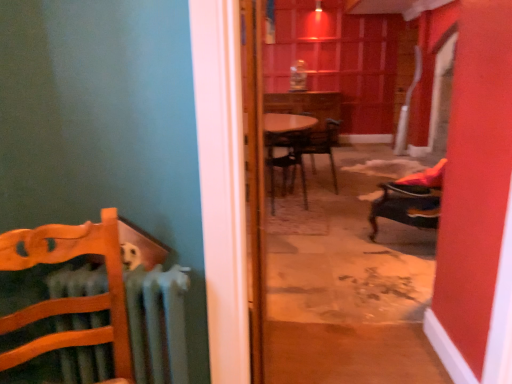
Describe the element at coordinates (410, 200) in the screenshot. I see `velvet orange chair at right, which ranks as the first chair in right-to-left order` at that location.

Where is `wooden chair at left, the first chair viewed from the front`? The height and width of the screenshot is (384, 512). wooden chair at left, the first chair viewed from the front is located at coordinates (70, 297).

The image size is (512, 384). In order to click on velvet orange chair at right, which is counted as the fourth chair, starting from the left in this screenshot , I will do click(410, 200).

Considering the relative sizes of wooden door at center and velvet orange chair at right, which is counted as the fourth chair, starting from the left, in the image provided, is wooden door at center taller than velvet orange chair at right, which is counted as the fourth chair, starting from the left,?

Yes.

Is wooden door at center not near velvet orange chair at right, which ranks as the first chair in right-to-left order?

Absolutely, wooden door at center is distant from velvet orange chair at right, which ranks as the first chair in right-to-left order.

Consider the image. Is wooden door at center oriented away from velvet orange chair at right, which ranks as the first chair in right-to-left order?

No, wooden door at center is not facing the opposite direction of velvet orange chair at right, which ranks as the first chair in right-to-left order.

Considering the positions of point (251, 249) and point (371, 209), is point (251, 249) closer or farther from the camera than point (371, 209)?

Clearly, point (251, 249) is closer to the camera than point (371, 209).

Looking at the image, does velvet orange chair at right, which is counted as the second chair, starting from the front, seem bigger or smaller compared to wooden chair at left, placed as the 4th chair when sorted from back to front?

Considering their sizes, velvet orange chair at right, which is counted as the second chair, starting from the front, takes up more space than wooden chair at left, placed as the 4th chair when sorted from back to front.

Could you tell me if velvet orange chair at right, which is counted as the second chair, starting from the front, is turned towards wooden chair at left, the 4th chair when ordered from right to left?

No, velvet orange chair at right, which is counted as the second chair, starting from the front, is not aimed at wooden chair at left, the 4th chair when ordered from right to left.

This screenshot has width=512, height=384. In order to click on the 1st chair behind the wooden chair at left, the first chair viewed from the front, counting from the anchor's position in this screenshot , I will do `click(410, 200)`.

Does metallic dark brown chair at center, marked as the third chair in a left-to-right arrangement, have a greater height compared to wooden door at center?

No.

Which is further, (x=325, y=136) or (x=247, y=113)?

The point (x=325, y=136) is behind.

From the picture: From the image's perspective, is metallic dark brown chair at center, the 4th chair positioned from the front, located above wooden door at center?

Yes, from the image's perspective, metallic dark brown chair at center, the 4th chair positioned from the front, is on top of wooden door at center.

Is metallic dark brown chair at center, the 4th chair positioned from the front, placed right next to wooden door at center?

metallic dark brown chair at center, the 4th chair positioned from the front, and wooden door at center are not in contact.

Which object is closer to the camera taking this photo, velvet orange chair at right, which is counted as the fourth chair, starting from the left, or metallic dark brown chair at center, the 4th chair positioned from the front?

velvet orange chair at right, which is counted as the fourth chair, starting from the left.

Measure the distance from velvet orange chair at right, which is counted as the second chair, starting from the front, to metallic dark brown chair at center, the 4th chair positioned from the front.

The distance of velvet orange chair at right, which is counted as the second chair, starting from the front, from metallic dark brown chair at center, the 4th chair positioned from the front, is 6.07 feet.

Can you confirm if velvet orange chair at right, positioned as the third chair in back-to-front order, is thinner than metallic dark brown chair at center, the 4th chair positioned from the front?

Correct, the width of velvet orange chair at right, positioned as the third chair in back-to-front order, is less than that of metallic dark brown chair at center, the 4th chair positioned from the front.

From a real-world perspective, which is physically above, velvet orange chair at right, which is counted as the fourth chair, starting from the left, or metallic dark brown chair at center, which is counted as the second chair, starting from the right?

metallic dark brown chair at center, which is counted as the second chair, starting from the right.

Which is behind, wooden chair at left, the first chair viewed from the front, or wooden door at center?

Positioned behind is wooden door at center.

Is point (122, 354) in front of point (252, 201)?

That is True.

Considering the relative sizes of wooden chair at left, the 1th chair viewed from the left, and wooden door at center in the image provided, is wooden chair at left, the 1th chair viewed from the left, bigger than wooden door at center?

Actually, wooden chair at left, the 1th chair viewed from the left, might be smaller than wooden door at center.

Could you tell me if wooden chair at left, the 4th chair when ordered from right to left, is facing wooden door at center?

No, wooden chair at left, the 4th chair when ordered from right to left, does not turn towards wooden door at center.

Is wooden chair at center, marked as the 2th chair in a back-to-front arrangement, taller or shorter than wooden chair at left, the first chair viewed from the front?

wooden chair at center, marked as the 2th chair in a back-to-front arrangement, is taller than wooden chair at left, the first chair viewed from the front.

Which is in front, point (305, 201) or point (5, 328)?

The point (5, 328) is more forward.

Would you say wooden chair at left, the 1th chair viewed from the left, is part of wooden chair at center, the third chair positioned from the right,'s contents?

No, wooden chair at left, the 1th chair viewed from the left, is located outside of wooden chair at center, the third chair positioned from the right.

From the image's perspective, would you say wooden chair at center, marked as the 2th chair in a back-to-front arrangement, is shown under wooden chair at left, the 1th chair viewed from the left?

Incorrect, from the image's perspective, wooden chair at center, marked as the 2th chair in a back-to-front arrangement, is higher than wooden chair at left, the 1th chair viewed from the left.

Does point (318, 134) appear closer or farther from the camera than point (282, 185)?

Clearly, point (318, 134) is more distant from the camera than point (282, 185).

From a real-world perspective, count 1st chairs downward from the wooden chair at center, the third chair positioned from the right, and point to it. Please provide its 2D coordinates.

[(317, 145)]

Is metallic dark brown chair at center, the first chair viewed from the back, behind wooden chair at center, placed as the 3th chair when sorted from front to back?

Yes, it is.

This screenshot has width=512, height=384. In order to click on door to the left of velvet orange chair at right, which ranks as the first chair in right-to-left order in this screenshot , I will do `click(254, 179)`.

At what (x,y) coordinates should I click in order to perform the action: click on the 3rd chair directly beneath the wooden chair at left, the 1th chair viewed from the left (from a real-world perspective). Please return your answer as a coordinate pair (x, y). The height and width of the screenshot is (384, 512). Looking at the image, I should click on (410, 200).

From the image, which object appears to be farther from wooden chair at center, marked as the 2th chair in a back-to-front arrangement, wooden door at center or velvet orange chair at right, positioned as the third chair in back-to-front order?

wooden door at center is further to wooden chair at center, marked as the 2th chair in a back-to-front arrangement.

Estimate the real-world distances between objects in this image. Which object is closer to metallic dark brown chair at center, the first chair viewed from the back, velvet orange chair at right, which is counted as the fourth chair, starting from the left, or wooden chair at center, marked as the 2th chair in a back-to-front arrangement?

wooden chair at center, marked as the 2th chair in a back-to-front arrangement, is closer to metallic dark brown chair at center, the first chair viewed from the back.

When comparing their distances from wooden door at center, does velvet orange chair at right, which is counted as the second chair, starting from the front, or wooden chair at left, the 4th chair when ordered from right to left, seem further?

velvet orange chair at right, which is counted as the second chair, starting from the front, is positioned further to the anchor wooden door at center.

From the image, which object appears to be farther from wooden door at center, velvet orange chair at right, which ranks as the first chair in right-to-left order, or metallic dark brown chair at center, the first chair viewed from the back?

metallic dark brown chair at center, the first chair viewed from the back, is positioned further to the anchor wooden door at center.

Based on their spatial positions, is wooden chair at center, the third chair positioned from the right, or metallic dark brown chair at center, which is counted as the second chair, starting from the right, closer to velvet orange chair at right, which is counted as the fourth chair, starting from the left?

Based on the image, wooden chair at center, the third chair positioned from the right, appears to be nearer to velvet orange chair at right, which is counted as the fourth chair, starting from the left.

Looking at the image, which one is located closer to wooden chair at center, marked as the 2th chair in a back-to-front arrangement, velvet orange chair at right, which ranks as the first chair in right-to-left order, or wooden door at center?

Based on the image, velvet orange chair at right, which ranks as the first chair in right-to-left order, appears to be nearer to wooden chair at center, marked as the 2th chair in a back-to-front arrangement.

Based on their spatial positions, is wooden door at center or wooden chair at center, the 2th chair positioned from the left, further from wooden chair at left, the 1th chair viewed from the left?

wooden chair at center, the 2th chair positioned from the left, lies further to wooden chair at left, the 1th chair viewed from the left, than the other object.

Estimate the real-world distances between objects in this image. Which object is further from metallic dark brown chair at center, the 4th chair positioned from the front, wooden door at center or wooden chair at center, the 2th chair positioned from the left?

wooden door at center is further to metallic dark brown chair at center, the 4th chair positioned from the front.

Where is `door between wooden chair at left, the first chair viewed from the front, and velvet orange chair at right, which is counted as the second chair, starting from the front, from front to back`? This screenshot has width=512, height=384. door between wooden chair at left, the first chair viewed from the front, and velvet orange chair at right, which is counted as the second chair, starting from the front, from front to back is located at coordinates (254, 179).

This screenshot has width=512, height=384. Identify the location of chair located between wooden door at center and wooden chair at center, marked as the 2th chair in a back-to-front arrangement, in the depth direction. (410, 200).

Where is `door between wooden chair at left, placed as the 4th chair when sorted from back to front, and metallic dark brown chair at center, which is counted as the second chair, starting from the right, from front to back`? door between wooden chair at left, placed as the 4th chair when sorted from back to front, and metallic dark brown chair at center, which is counted as the second chair, starting from the right, from front to back is located at coordinates (254, 179).

This screenshot has width=512, height=384. In order to click on door located between wooden chair at left, the 1th chair viewed from the left, and wooden chair at center, marked as the 2th chair in a back-to-front arrangement, in the depth direction in this screenshot , I will do `click(254, 179)`.